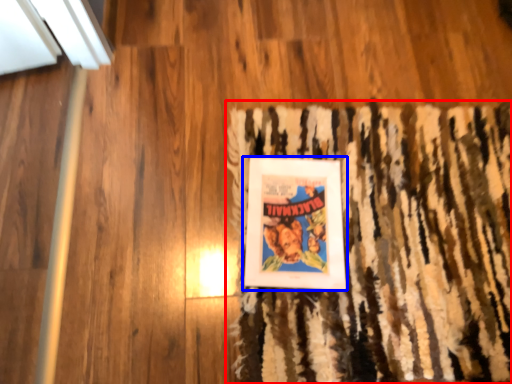
Question: Which point is closer to the camera, doormat (highlighted by a red box) or picture frame (highlighted by a blue box)?

Choices:
 (A) doormat
 (B) picture frame

Answer: (A)